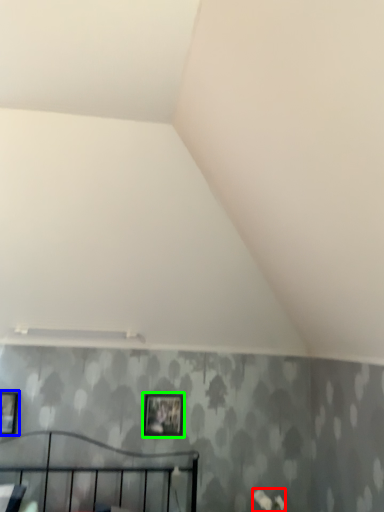
Question: Estimate the real-world distances between objects in this image. Which object is farther from flower (highlighted by a red box), picture frame (highlighted by a blue box) or picture frame (highlighted by a green box)?

Choices:
 (A) picture frame
 (B) picture frame

Answer: (A)